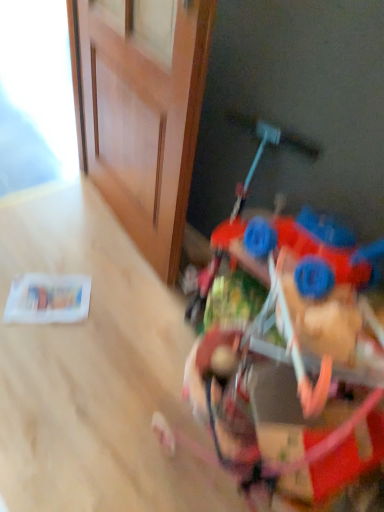
Question: Does plastic toy car at lower right have a greater width compared to wooden door at upper left?

Choices:
 (A) no
 (B) yes

Answer: (B)

Question: Does plastic toy car at lower right have a greater height compared to wooden door at upper left?

Choices:
 (A) no
 (B) yes

Answer: (A)

Question: Does plastic toy car at lower right have a lesser width compared to wooden door at upper left?

Choices:
 (A) yes
 (B) no

Answer: (B)

Question: Is plastic toy car at lower right not within wooden door at upper left?

Choices:
 (A) no
 (B) yes

Answer: (B)

Question: Is plastic toy car at lower right looking in the opposite direction of wooden door at upper left?

Choices:
 (A) no
 (B) yes

Answer: (A)

Question: Is plastic toy car at lower right shorter than wooden door at upper left?

Choices:
 (A) yes
 (B) no

Answer: (A)

Question: Is wooden door at upper left positioned beyond the bounds of plastic toy car at lower right?

Choices:
 (A) yes
 (B) no

Answer: (A)

Question: Is wooden door at upper left not near plastic toy car at lower right?

Choices:
 (A) yes
 (B) no

Answer: (B)

Question: Considering the relative sizes of wooden door at upper left and plastic toy car at lower right in the image provided, is wooden door at upper left taller than plastic toy car at lower right?

Choices:
 (A) no
 (B) yes

Answer: (B)

Question: Is wooden door at upper left oriented towards plastic toy car at lower right?

Choices:
 (A) no
 (B) yes

Answer: (A)

Question: Considering the relative sizes of wooden door at upper left and plastic toy car at lower right in the image provided, is wooden door at upper left wider than plastic toy car at lower right?

Choices:
 (A) yes
 (B) no

Answer: (B)

Question: Does wooden door at upper left have a lesser width compared to plastic toy car at lower right?

Choices:
 (A) no
 (B) yes

Answer: (B)

Question: Does point (251, 381) appear closer or farther from the camera than point (124, 59)?

Choices:
 (A) farther
 (B) closer

Answer: (B)